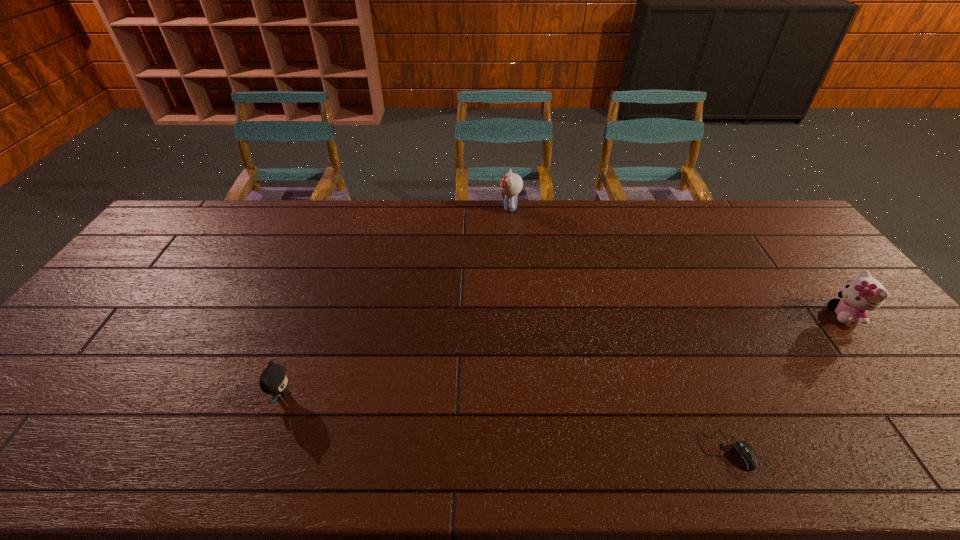
You are a GUI agent. You are given a task and a screenshot of the screen. Output one action in this format:
    pyautogui.click(x=<x>, y=<y>)
    Task: Click on the vacant area that lies between the nearest object and the rightmost kitten
    This screenshot has height=540, width=960.
    Given the screenshot: What is the action you would take?
    pyautogui.click(x=785, y=382)

You are a GUI agent. You are given a task and a screenshot of the screen. Output one action in this format:
    pyautogui.click(x=<x>, y=<y>)
    Task: Click on the vacant region between the second kitten from right to left and the leftmost kitten
    Image resolution: width=960 pixels, height=540 pixels.
    Given the screenshot: What is the action you would take?
    pyautogui.click(x=396, y=301)

Locate an element on the screen. empty location between the second nearest kitten and the farthest kitten is located at coordinates (678, 261).

Image resolution: width=960 pixels, height=540 pixels. I want to click on the second closest object to the second shortest object, so click(745, 454).

This screenshot has width=960, height=540. Identify the location of the second closest object to the second nearest kitten. (511, 184).

Point out which kitten is positioned as the second nearest to the computer mouse. Please provide its 2D coordinates. Your answer should be formatted as a tuple, i.e. [(x, y)], where the tuple contains the x and y coordinates of a point satisfying the conditions above.

[(511, 184)]

Identify which kitten is located as the second nearest to the shortest object. Please provide its 2D coordinates. Your answer should be formatted as a tuple, i.e. [(x, y)], where the tuple contains the x and y coordinates of a point satisfying the conditions above.

[(511, 184)]

At what (x,y) coordinates should I click in order to perform the action: click on vacant space that satisfies the following two spatial constraints: 1. on the front-facing side of the second shortest object; 2. on the left side of the third object from left to right. Please return your answer as a coordinate pair (x, y). The height and width of the screenshot is (540, 960). Looking at the image, I should click on coord(262,450).

Identify the location of free region that satisfies the following two spatial constraints: 1. on the front-facing side of the farthest kitten; 2. on the back side of the shortest object. (531, 450).

Identify the location of free point that satisfies the following two spatial constraints: 1. on the front-facing side of the computer mouse; 2. on the right side of the second kitten from right to left. (531, 450).